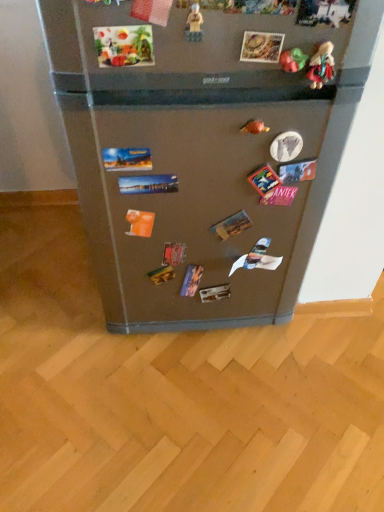
Identify the location of translucent plastic toy at upper center, the first toy positioned from the front. This screenshot has width=384, height=512. (194, 24).

Measure the distance between translucent plastic toy at upper center, arranged as the 4th toy when viewed from the back, and camera.

The distance of translucent plastic toy at upper center, arranged as the 4th toy when viewed from the back, from camera is 26.71 inches.

Describe the element at coordinates (254, 127) in the screenshot. I see `rubber duck at upper right, positioned as the 3th toy in right-to-left order` at that location.

Locate an element on the screen. This screenshot has width=384, height=512. satin silver fridge at center is located at coordinates (203, 150).

Locate an element on the screen. The image size is (384, 512). matte plastic toy at upper right, the 3th toy in the left-to-right sequence is located at coordinates (293, 60).

Looking at this image, considering the relative sizes of satin silver fridge at center and translucent plastic toy at upper center, placed as the fourth toy when sorted from right to left, in the image provided, is satin silver fridge at center smaller than translucent plastic toy at upper center, placed as the fourth toy when sorted from right to left,?

Incorrect, satin silver fridge at center is not smaller in size than translucent plastic toy at upper center, placed as the fourth toy when sorted from right to left.

Is satin silver fridge at center in contact with translucent plastic toy at upper center, placed as the fourth toy when sorted from right to left?

satin silver fridge at center and translucent plastic toy at upper center, placed as the fourth toy when sorted from right to left, are not in contact.

From their relative heights in the image, would you say satin silver fridge at center is taller or shorter than translucent plastic toy at upper center, arranged as the 1th toy when viewed from the left?

satin silver fridge at center is taller than translucent plastic toy at upper center, arranged as the 1th toy when viewed from the left.

There is a satin silver fridge at center. Where is `the 4th toy above it (from the image's perspective)`? This screenshot has width=384, height=512. the 4th toy above it (from the image's perspective) is located at coordinates (194, 24).

From a real-world perspective, is rubber duck at upper right, placed as the second toy when sorted from left to right, located beneath satin silver fridge at center?

No, from a real-world perspective, rubber duck at upper right, placed as the second toy when sorted from left to right, is not under satin silver fridge at center.

Considering the positions of objects rubber duck at upper right, positioned as the 3th toy in right-to-left order, and satin silver fridge at center in the image provided, who is behind, rubber duck at upper right, positioned as the 3th toy in right-to-left order, or satin silver fridge at center?

rubber duck at upper right, positioned as the 3th toy in right-to-left order, is behind.

Considering the relative positions of rubber duck at upper right, positioned as the 3th toy in right-to-left order, and satin silver fridge at center in the image provided, is rubber duck at upper right, positioned as the 3th toy in right-to-left order, to the right of satin silver fridge at center from the viewer's perspective?

Yes, rubber duck at upper right, positioned as the 3th toy in right-to-left order, is to the right of satin silver fridge at center.

Is satin silver fridge at center at the left side of matte plastic toy at upper right, arranged as the second toy when viewed from the right?

Correct, you'll find satin silver fridge at center to the left of matte plastic toy at upper right, arranged as the second toy when viewed from the right.

Is satin silver fridge at center in contact with matte plastic toy at upper right, the 3th toy in the left-to-right sequence?

satin silver fridge at center and matte plastic toy at upper right, the 3th toy in the left-to-right sequence, are not in contact.

Which is farther from the camera, (182, 252) or (302, 63)?

The point (182, 252) is behind.

Who is shorter, rubber duck at upper right, positioned as the 3th toy in right-to-left order, or matte plastic toy at upper right, the 3th toy in the left-to-right sequence?

rubber duck at upper right, positioned as the 3th toy in right-to-left order.

Measure the distance between rubber duck at upper right, placed as the second toy when sorted from left to right, and matte plastic toy at upper right, arranged as the second toy when viewed from the right.

rubber duck at upper right, placed as the second toy when sorted from left to right, is 4.93 inches from matte plastic toy at upper right, arranged as the second toy when viewed from the right.

Is point (259, 122) closer to viewer compared to point (303, 58)?

No, (259, 122) is further to viewer.

From the image's perspective, is rubber duck at upper right, marked as the 1th toy in a back-to-front arrangement, on matte plastic toy at upper right, which ranks as the 3th toy in front-to-back order?

No, from the image's perspective, rubber duck at upper right, marked as the 1th toy in a back-to-front arrangement, is not on top of matte plastic toy at upper right, which ranks as the 3th toy in front-to-back order.

Which of these two, translucent plastic toy at upper center, arranged as the 4th toy when viewed from the back, or matte plastic doll at upper right, acting as the fourth toy starting from the left, is smaller?

translucent plastic toy at upper center, arranged as the 4th toy when viewed from the back.

From the image's perspective, between translucent plastic toy at upper center, arranged as the 4th toy when viewed from the back, and matte plastic doll at upper right, which is the 2th toy in front-to-back order, who is located below?

matte plastic doll at upper right, which is the 2th toy in front-to-back order, appears lower in the image.

Is translucent plastic toy at upper center, placed as the fourth toy when sorted from right to left, touching matte plastic doll at upper right, the third toy viewed from the back?

No, translucent plastic toy at upper center, placed as the fourth toy when sorted from right to left, is not touching matte plastic doll at upper right, the third toy viewed from the back.

Is translucent plastic toy at upper center, arranged as the 1th toy when viewed from the left, at the right side of matte plastic doll at upper right, which ranks as the 1th toy in right-to-left order?

In fact, translucent plastic toy at upper center, arranged as the 1th toy when viewed from the left, is to the left of matte plastic doll at upper right, which ranks as the 1th toy in right-to-left order.

Who is taller, satin silver fridge at center or matte plastic doll at upper right, which ranks as the 1th toy in right-to-left order?

With more height is satin silver fridge at center.

Does satin silver fridge at center appear on the left side of matte plastic doll at upper right, acting as the fourth toy starting from the left?

Yes, satin silver fridge at center is to the left of matte plastic doll at upper right, acting as the fourth toy starting from the left.

Which is behind, point (274, 277) or point (314, 61)?

The point (274, 277) is behind.

Is satin silver fridge at center facing away from matte plastic doll at upper right, which ranks as the 1th toy in right-to-left order?

Correct, satin silver fridge at center is looking away from matte plastic doll at upper right, which ranks as the 1th toy in right-to-left order.

From the image's perspective, is rubber duck at upper right, placed as the fourth toy when sorted from front to back, located above or below matte plastic doll at upper right, which is the 2th toy in front-to-back order?

Based on their image positions, rubber duck at upper right, placed as the fourth toy when sorted from front to back, is located beneath matte plastic doll at upper right, which is the 2th toy in front-to-back order.

Considering the relative positions of rubber duck at upper right, placed as the fourth toy when sorted from front to back, and matte plastic doll at upper right, which is the 2th toy in front-to-back order, in the image provided, is rubber duck at upper right, placed as the fourth toy when sorted from front to back, behind matte plastic doll at upper right, which is the 2th toy in front-to-back order,?

Yes, rubber duck at upper right, placed as the fourth toy when sorted from front to back, is further from the viewer.

Find the location of a particular element. This screenshot has height=512, width=384. toy that is the 2nd object located in front of the rubber duck at upper right, marked as the 1th toy in a back-to-front arrangement is located at coordinates (321, 66).

Is matte plastic doll at upper right, acting as the fourth toy starting from the left, completely or partially inside rubber duck at upper right, marked as the 1th toy in a back-to-front arrangement?

No.

Identify the location of refrigerator located below the translucent plastic toy at upper center, placed as the fourth toy when sorted from right to left (from the image's perspective). (203, 150).

Locate an element on the screen. The height and width of the screenshot is (512, 384). refrigerator on the left of rubber duck at upper right, placed as the second toy when sorted from left to right is located at coordinates (203, 150).

Based on their spatial positions, is rubber duck at upper right, positioned as the 3th toy in right-to-left order, or satin silver fridge at center closer to translucent plastic toy at upper center, arranged as the 1th toy when viewed from the left?

rubber duck at upper right, positioned as the 3th toy in right-to-left order, lies closer to translucent plastic toy at upper center, arranged as the 1th toy when viewed from the left, than the other object.

When comparing their distances from matte plastic toy at upper right, arranged as the second toy when viewed from the right, does satin silver fridge at center or translucent plastic toy at upper center, arranged as the 1th toy when viewed from the left, seem further?

satin silver fridge at center is further to matte plastic toy at upper right, arranged as the second toy when viewed from the right.

Based on their spatial positions, is matte plastic toy at upper right, arranged as the second toy when viewed from the right, or rubber duck at upper right, placed as the fourth toy when sorted from front to back, closer to satin silver fridge at center?

Among the two, rubber duck at upper right, placed as the fourth toy when sorted from front to back, is located nearer to satin silver fridge at center.

Considering their positions, is satin silver fridge at center positioned further to matte plastic doll at upper right, which ranks as the 1th toy in right-to-left order, than matte plastic toy at upper right, placed as the second toy when sorted from back to front?

satin silver fridge at center.

Based on their spatial positions, is satin silver fridge at center or translucent plastic toy at upper center, arranged as the 4th toy when viewed from the back, closer to rubber duck at upper right, placed as the fourth toy when sorted from front to back?

Among the two, translucent plastic toy at upper center, arranged as the 4th toy when viewed from the back, is located nearer to rubber duck at upper right, placed as the fourth toy when sorted from front to back.

Considering their positions, is rubber duck at upper right, placed as the fourth toy when sorted from front to back, positioned further to matte plastic doll at upper right, acting as the fourth toy starting from the left, than matte plastic toy at upper right, which ranks as the 3th toy in front-to-back order?

rubber duck at upper right, placed as the fourth toy when sorted from front to back, is positioned further to the anchor matte plastic doll at upper right, acting as the fourth toy starting from the left.

From the image, which object appears to be nearer to satin silver fridge at center, translucent plastic toy at upper center, arranged as the 4th toy when viewed from the back, or rubber duck at upper right, positioned as the 3th toy in right-to-left order?

Based on the image, rubber duck at upper right, positioned as the 3th toy in right-to-left order, appears to be nearer to satin silver fridge at center.

Which object lies further to the anchor point rubber duck at upper right, placed as the fourth toy when sorted from front to back, matte plastic doll at upper right, acting as the fourth toy starting from the left, or matte plastic toy at upper right, the 3th toy in the left-to-right sequence?

The object further to rubber duck at upper right, placed as the fourth toy when sorted from front to back, is matte plastic doll at upper right, acting as the fourth toy starting from the left.

Identify the location of toy between translucent plastic toy at upper center, arranged as the 1th toy when viewed from the left, and matte plastic toy at upper right, which ranks as the 3th toy in front-to-back order. (254, 127).

Locate an element on the screen. Image resolution: width=384 pixels, height=512 pixels. toy between matte plastic doll at upper right, the third toy viewed from the back, and satin silver fridge at center from top to bottom is located at coordinates (254, 127).

Identify the location of toy between matte plastic doll at upper right, the third toy viewed from the back, and rubber duck at upper right, placed as the fourth toy when sorted from front to back, from front to back. 293,60.